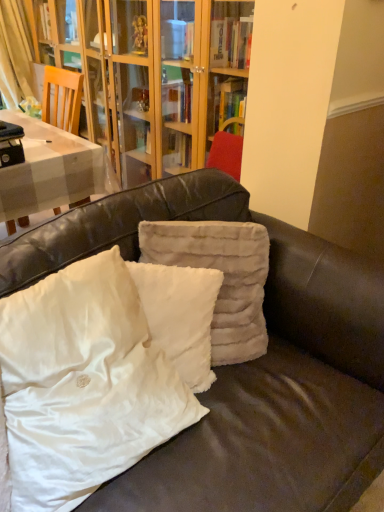
Question: Can we say fuzzy beige pillow at center, which ranks as the first pillow in right-to-left order, lies outside white fluffy pillow at center, which ranks as the 2th pillow in left-to-right order?

Choices:
 (A) no
 (B) yes

Answer: (B)

Question: Considering the relative sizes of fuzzy beige pillow at center, which is counted as the 3th pillow, starting from the left, and white fluffy pillow at center, marked as the 2th pillow in a right-to-left arrangement, in the image provided, is fuzzy beige pillow at center, which is counted as the 3th pillow, starting from the left, smaller than white fluffy pillow at center, marked as the 2th pillow in a right-to-left arrangement,?

Choices:
 (A) yes
 (B) no

Answer: (B)

Question: Does fuzzy beige pillow at center, which ranks as the first pillow in right-to-left order, have a greater height compared to white fluffy pillow at center, marked as the 2th pillow in a right-to-left arrangement?

Choices:
 (A) yes
 (B) no

Answer: (A)

Question: From a real-world perspective, does fuzzy beige pillow at center, which ranks as the first pillow in right-to-left order, stand above white fluffy pillow at center, which ranks as the 2th pillow in left-to-right order?

Choices:
 (A) yes
 (B) no

Answer: (A)

Question: Is fuzzy beige pillow at center, which ranks as the first pillow in right-to-left order, positioned with its back to white fluffy pillow at center, which ranks as the 2th pillow in left-to-right order?

Choices:
 (A) yes
 (B) no

Answer: (A)

Question: Relative to white fluffy pillow at center, the first pillow in the left-to-right sequence, is fuzzy beige pillow at center, which ranks as the first pillow in right-to-left order, in front or behind?

Choices:
 (A) front
 (B) behind

Answer: (B)

Question: From a real-world perspective, is fuzzy beige pillow at center, which ranks as the first pillow in right-to-left order, physically located above or below white fluffy pillow at center, the first pillow in the left-to-right sequence?

Choices:
 (A) above
 (B) below

Answer: (A)

Question: Is point (231, 243) closer or farther from the camera than point (82, 393)?

Choices:
 (A) closer
 (B) farther

Answer: (B)

Question: In terms of width, does fuzzy beige pillow at center, which is counted as the 3th pillow, starting from the left, look wider or thinner when compared to white fluffy pillow at center, positioned as the third pillow in right-to-left order?

Choices:
 (A) wide
 (B) thin

Answer: (B)

Question: Does point (190, 397) appear closer or farther from the camera than point (208, 377)?

Choices:
 (A) farther
 (B) closer

Answer: (B)

Question: Is white fluffy pillow at center, the first pillow in the left-to-right sequence, situated inside white fluffy pillow at center, which ranks as the 2th pillow in left-to-right order, or outside?

Choices:
 (A) inside
 (B) outside

Answer: (B)

Question: From the image's perspective, relative to white fluffy pillow at center, marked as the 2th pillow in a right-to-left arrangement, is white fluffy pillow at center, positioned as the third pillow in right-to-left order, above or below?

Choices:
 (A) below
 (B) above

Answer: (A)

Question: From a real-world perspective, is white fluffy pillow at center, positioned as the third pillow in right-to-left order, physically located above or below white fluffy pillow at center, which ranks as the 2th pillow in left-to-right order?

Choices:
 (A) above
 (B) below

Answer: (A)

Question: From a real-world perspective, is white fluffy pillow at center, marked as the 2th pillow in a right-to-left arrangement, positioned above or below fuzzy beige pillow at center, which is counted as the 3th pillow, starting from the left?

Choices:
 (A) above
 (B) below

Answer: (B)

Question: From the image's perspective, is white fluffy pillow at center, marked as the 2th pillow in a right-to-left arrangement, positioned above or below fuzzy beige pillow at center, which ranks as the first pillow in right-to-left order?

Choices:
 (A) above
 (B) below

Answer: (B)